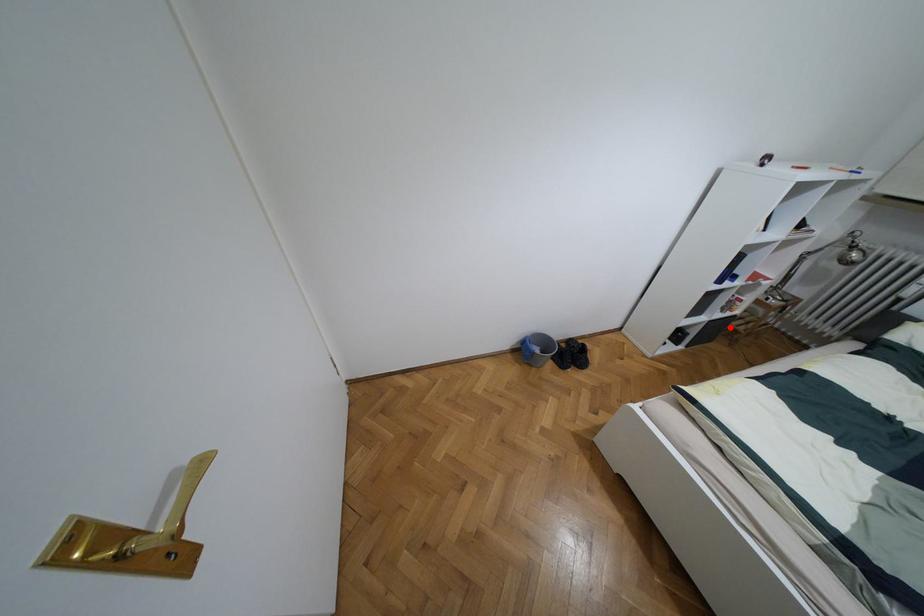
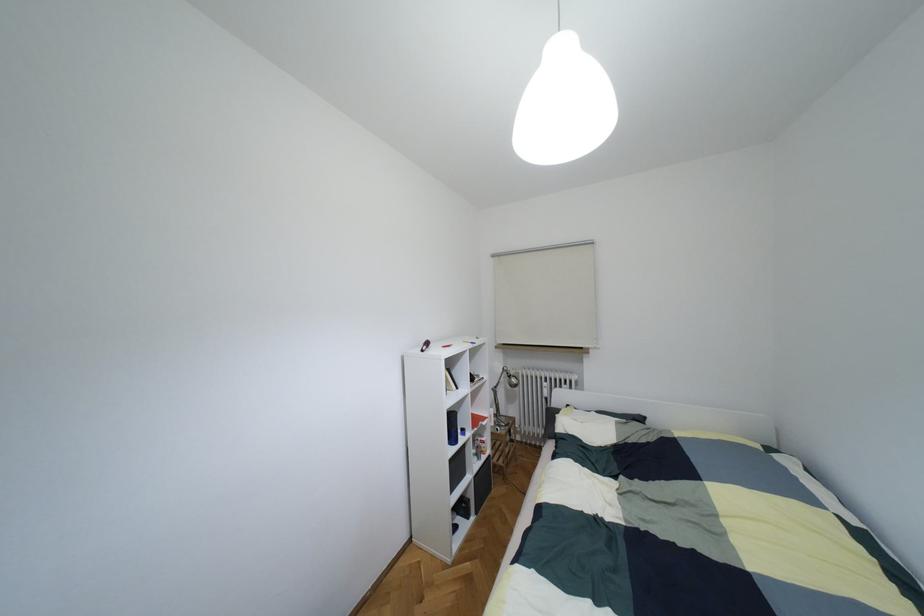
Find the pixel in the second image that matches the highlighted location in the first image.

(493, 464)